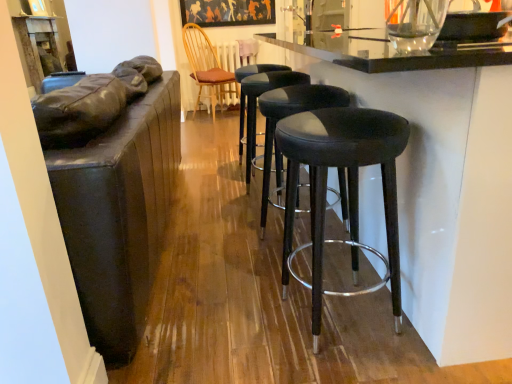
This screenshot has height=384, width=512. I want to click on free point to the left of black leather stool at center, the first stool when ordered from back to front, so click(221, 195).